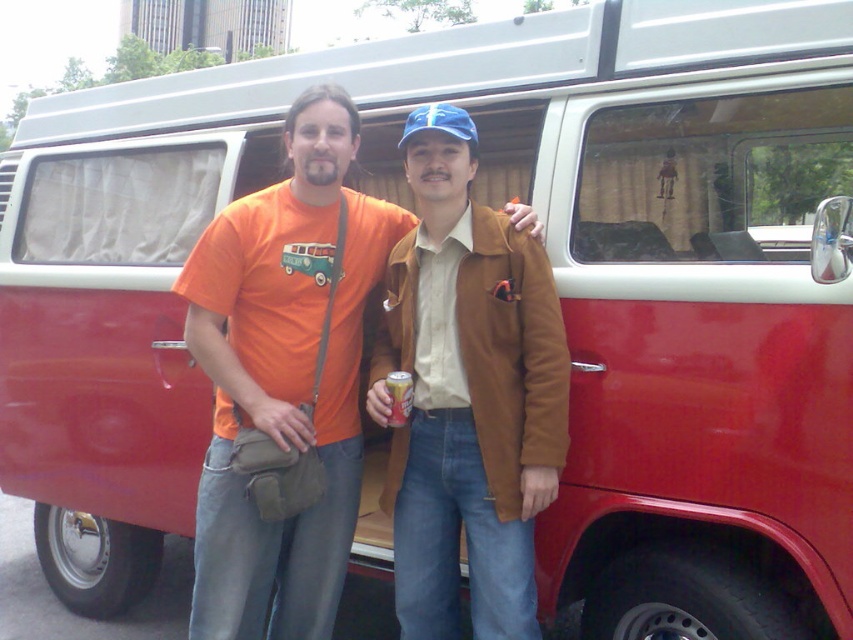
You are a delivery person who needs to place a 12 inch long package between the brown leather jacket at center and the orange aluminum can at center. Can you fit it there?

The brown leather jacket at center is 13.27 inches from the orange aluminum can at center, so yes, the 12 inch package can fit between them since the distance is sufficient.